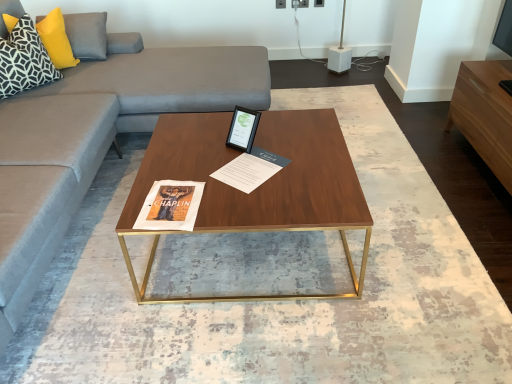
Question: In the image, is light brown wood entertainment center at right positioned in front of or behind matte paper magazine at center?

Choices:
 (A) front
 (B) behind

Answer: (B)

Question: Considering the positions of light brown wood entertainment center at right and matte paper magazine at center in the image, is light brown wood entertainment center at right taller or shorter than matte paper magazine at center?

Choices:
 (A) short
 (B) tall

Answer: (B)

Question: Considering the real-world distances, which object is closest to the yellow fabric pillow at upper left, marked as the 2th pillow in a front-to-back arrangement?

Choices:
 (A) light brown wood entertainment center at right
 (B) matte black tablet at center
 (C) wooden polished coffee table at center
 (D) black and white geometric fabric pillow at upper left, the second pillow from the back
 (E) matte paper magazine at center

Answer: (D)

Question: Based on their relative distances, which object is farther from the matte black tablet at center?

Choices:
 (A) light brown wood entertainment center at right
 (B) black and white geometric fabric pillow at upper left, the 1th pillow when ordered from front to back
 (C) yellow fabric pillow at upper left, positioned as the first pillow in back-to-front order
 (D) wooden polished coffee table at center
 (E) matte paper magazine at center

Answer: (C)